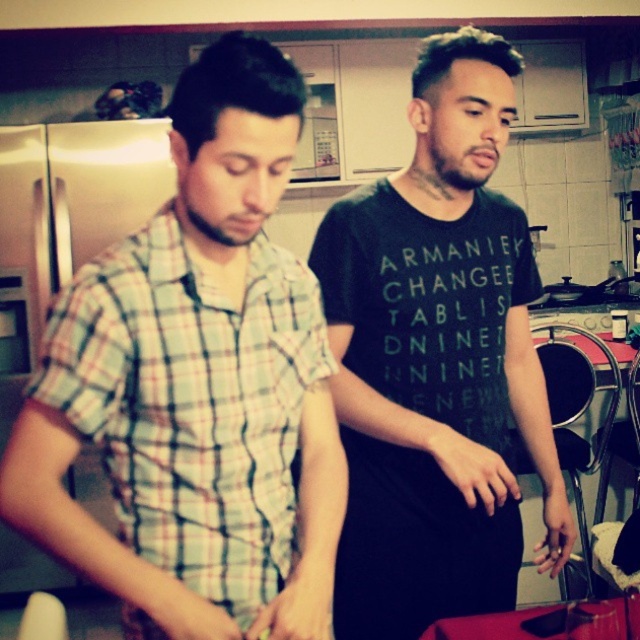
Question: Which point is farther from the camera taking this photo?

Choices:
 (A) (148, 540)
 (B) (508, 120)

Answer: (B)

Question: Which object is closer to the camera taking this photo?

Choices:
 (A) plaid cotton shirt at center
 (B) black matte t-shirt at center

Answer: (A)

Question: Does plaid cotton shirt at center have a larger size compared to black matte t-shirt at center?

Choices:
 (A) yes
 (B) no

Answer: (B)

Question: Is plaid cotton shirt at center bigger than black matte t-shirt at center?

Choices:
 (A) yes
 (B) no

Answer: (B)

Question: Which of the following is the farthest from the observer?

Choices:
 (A) (474, 449)
 (B) (268, 374)

Answer: (A)

Question: Does plaid cotton shirt at center have a larger size compared to black matte t-shirt at center?

Choices:
 (A) no
 (B) yes

Answer: (A)